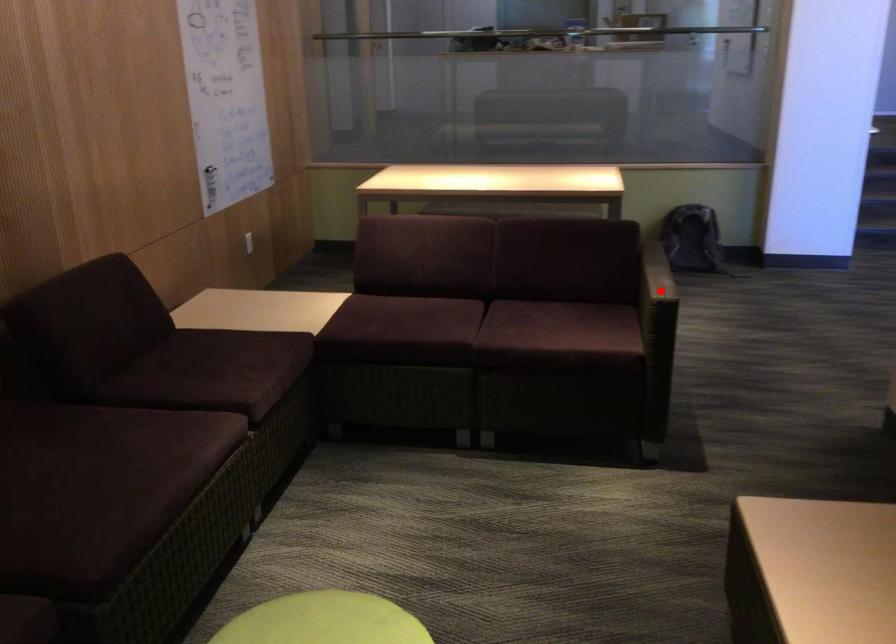
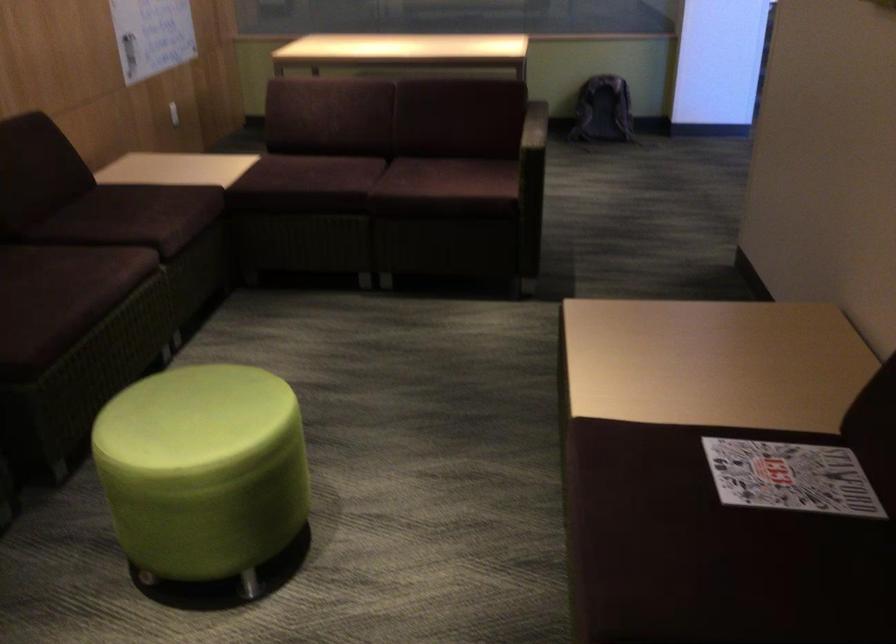
Question: I am providing you with two images of the same scene from different viewpoints. Image1 has a red point marked. In image2, the corresponding 3D location appears at what relative position? Reply with the corresponding letter.

Choices:
 (A) Closer
 (B) Farther

Answer: (B)